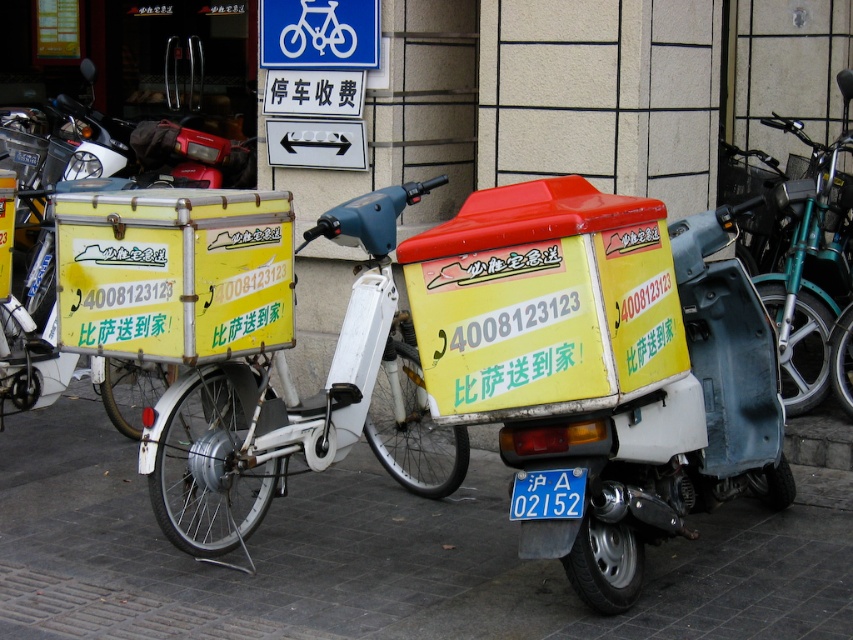
Question: Estimate the real-world distances between objects in this image. Which object is farther from the gray concrete pavement at lower center?

Choices:
 (A) blue metallic license plate at center
 (B) yellow matte delivery bike at center

Answer: (A)

Question: Is the position of gray concrete pavement at lower center more distant than that of teal metallic bicycle at right?

Choices:
 (A) yes
 (B) no

Answer: (B)

Question: Which of these objects is positioned farthest from the blue metallic license plate at center?

Choices:
 (A) teal metallic bicycle at right
 (B) gray concrete pavement at lower center
 (C) yellow matte delivery bike at center

Answer: (A)

Question: Can you confirm if yellow matte delivery bike at center is bigger than teal metallic bicycle at right?

Choices:
 (A) yes
 (B) no

Answer: (A)

Question: Can you confirm if gray concrete pavement at lower center is positioned above teal metallic bicycle at right?

Choices:
 (A) yes
 (B) no

Answer: (B)

Question: Estimate the real-world distances between objects in this image. Which object is closer to the gray concrete pavement at lower center?

Choices:
 (A) yellow matte delivery bike at center
 (B) teal metallic bicycle at right

Answer: (A)